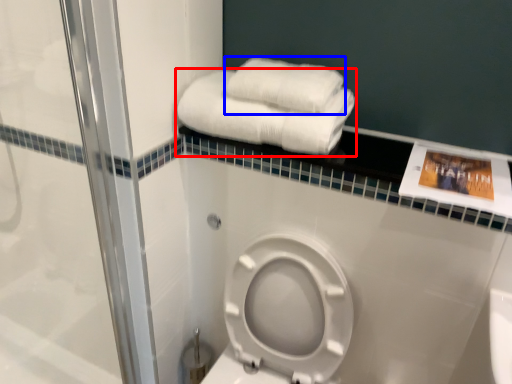
Question: Which point is closer to the camera, towel (highlighted by a red box) or towel (highlighted by a blue box)?

Choices:
 (A) towel
 (B) towel

Answer: (A)